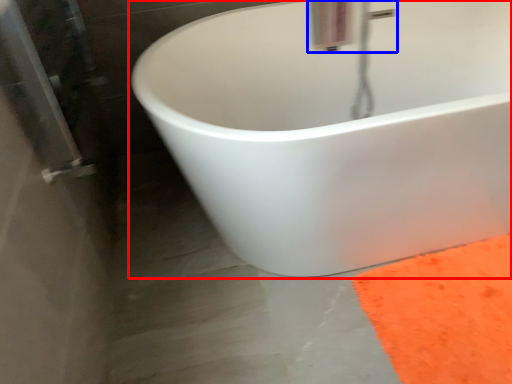
Question: Which object is closer to the camera taking this photo, bathtub (highlighted by a red box) or plumbing fixture (highlighted by a blue box)?

Choices:
 (A) bathtub
 (B) plumbing fixture

Answer: (A)